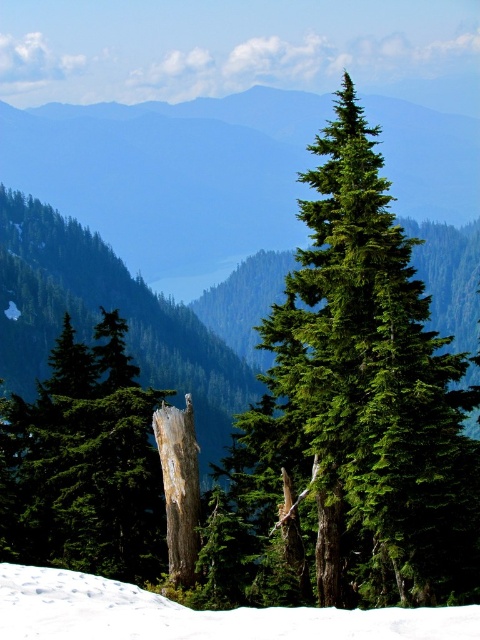
You are a hiker trying to cross the snow to reach the tree trunk. Based on the scene, can you step on the white snow at lower left to get to the white textured bark at center?

Yes, you can step on the white snow at lower left to reach the white textured bark at center because the white snow at lower left is in front of the white textured bark at center, meaning it is closer to you and provides a path.

You are a hiker planning to navigate between two points marked on a map. The first point is at coordinates point (76, 588) and the second is at point (180, 524). Given that you want to take the shortest path possible, which point should you head towards first?

Point (76, 588) is closer to the viewer than point (180, 524), so you should head towards point (76, 588) first to take the shortest path.